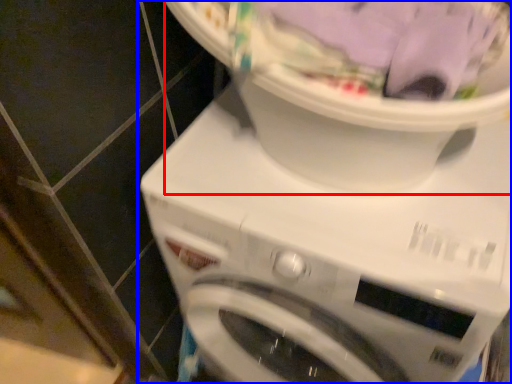
Question: Which of the following is the closest to the observer, machine (highlighted by a red box) or washing machine (highlighted by a blue box)?

Choices:
 (A) machine
 (B) washing machine

Answer: (A)